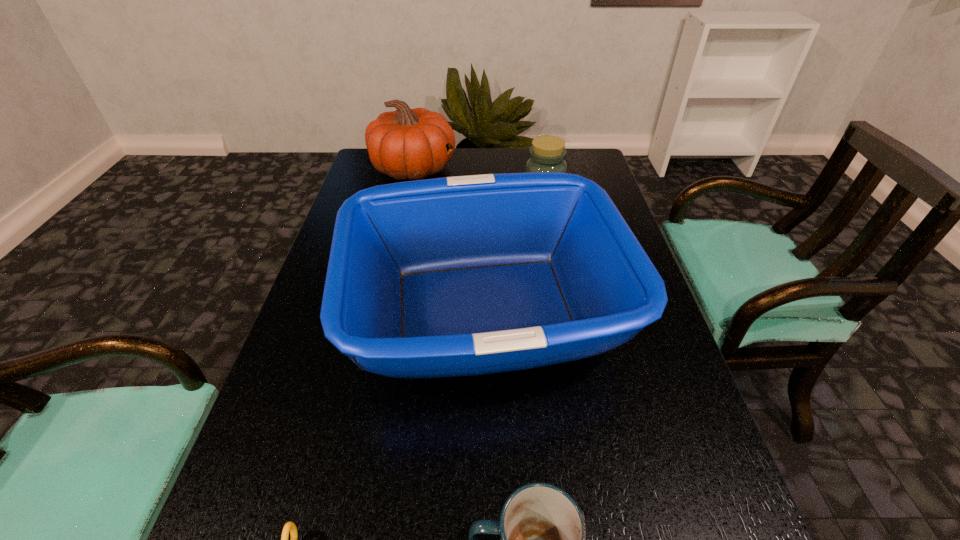
I want to click on pumpkin, so click(407, 144).

This screenshot has width=960, height=540. Find the location of `the third farthest object`. the third farthest object is located at coordinates (457, 276).

Locate an element on the screen. the third tallest object is located at coordinates click(x=548, y=153).

The image size is (960, 540). I want to click on free space located on the face of the pumpkin, so click(502, 169).

The height and width of the screenshot is (540, 960). In order to click on free space located on the back of the third nearest object in this screenshot , I will do `click(484, 186)`.

Locate an element on the screen. The image size is (960, 540). free location located on the right of the jar is located at coordinates (590, 191).

At what (x,y) coordinates should I click in order to perform the action: click on pumpkin located in the far edge section of the desktop. Please return your answer as a coordinate pair (x, y). The width and height of the screenshot is (960, 540). Looking at the image, I should click on (407, 144).

The width and height of the screenshot is (960, 540). Find the location of `jar situated at the far edge`. jar situated at the far edge is located at coordinates (548, 153).

Where is `pumpkin situated at the left edge`? Image resolution: width=960 pixels, height=540 pixels. pumpkin situated at the left edge is located at coordinates (407, 144).

In order to click on tray located in the left edge section of the desktop in this screenshot , I will do `click(457, 276)`.